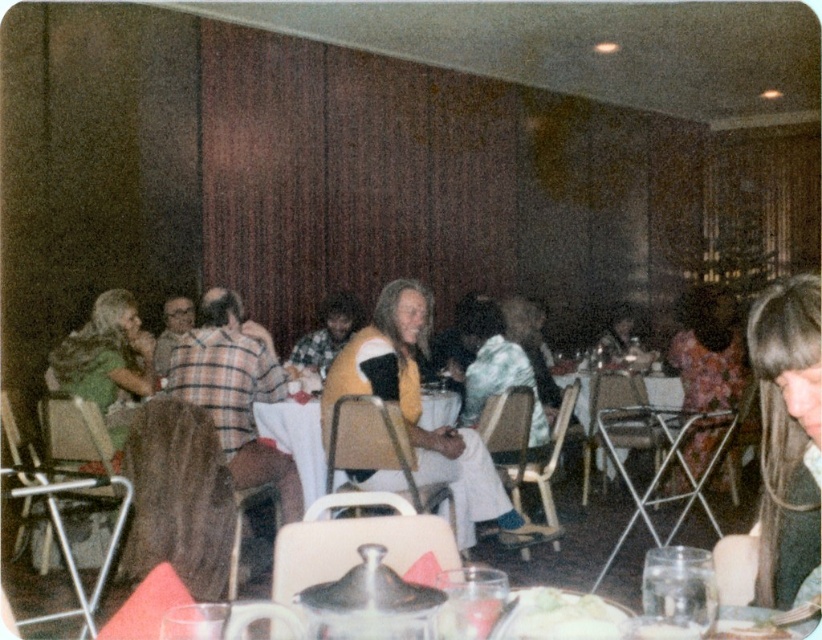
Which is behind, point (91, 387) or point (751, 625)?

Point (91, 387)

Which of these two, green fabric dress at left or translucent glass plate at center, stands taller?

Standing taller between the two is green fabric dress at left.

You are a GUI agent. You are given a task and a screenshot of the screen. Output one action in this format:
    pyautogui.click(x=<x>, y=<y>)
    Task: Click on the green fabric dress at left
    The image size is (822, 640).
    Given the screenshot: What is the action you would take?
    pyautogui.click(x=107, y=362)

Locate an element on the screen. This screenshot has height=640, width=822. green fabric dress at left is located at coordinates (107, 362).

Is the position of translucent glass bowl at center less distant than that of translucent glass plate at center?

Yes.

Between translucent glass bowl at center and translucent glass plate at center, which one appears on the right side from the viewer's perspective?

Positioned to the right is translucent glass plate at center.

Is point (469, 612) farther from camera compared to point (737, 637)?

No.

Identify the location of translucent glass bowl at center. The height and width of the screenshot is (640, 822). (469, 616).

Is yellow sweater at center closer to camera compared to translucent glass bowl at center?

No, it is not.

Consider the image. Does yellow sweater at center have a lesser width compared to translucent glass bowl at center?

No.

Image resolution: width=822 pixels, height=640 pixels. Identify the location of yellow sweater at center. (421, 410).